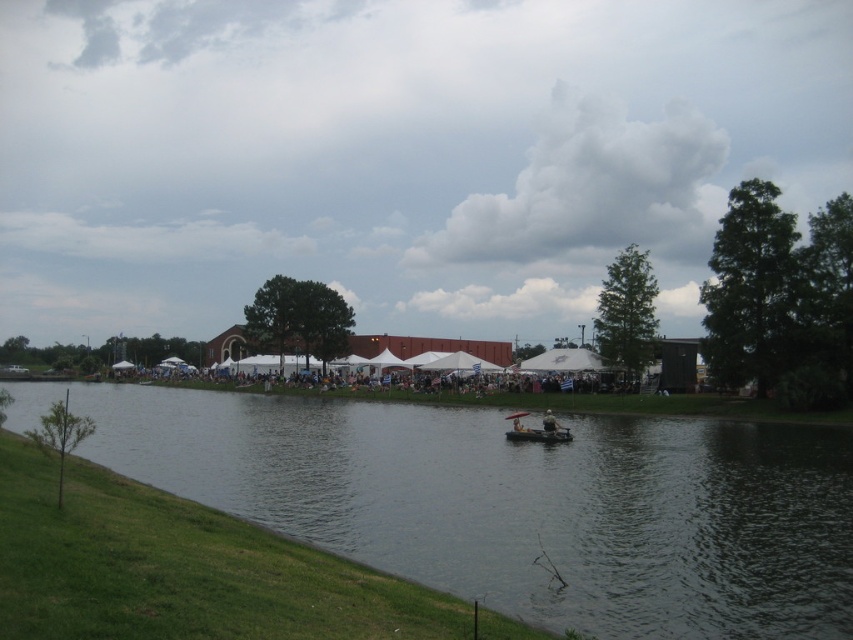
You are standing at the water edge and want to reach the wooden canoe at center. What direction should you move in to get there?

The wooden canoe at center is located at point (537, 429), so you should move towards the center of the image to reach it.